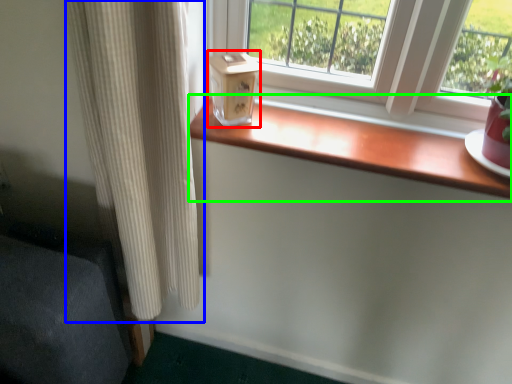
Question: Which object is positioned closest to window box (highlighted by a red box)? Select from curtain (highlighted by a blue box) and window sill (highlighted by a green box).

Choices:
 (A) curtain
 (B) window sill

Answer: (B)